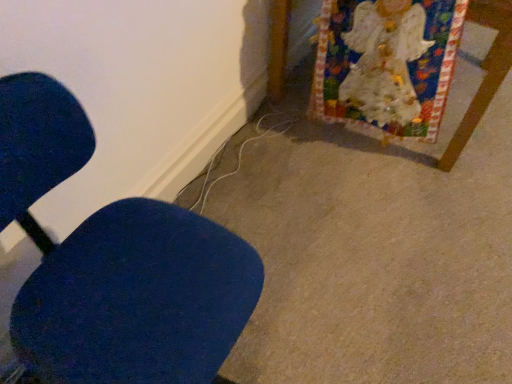
Describe the element at coordinates (114, 263) in the screenshot. I see `blue fabric chair at left` at that location.

I want to click on blue fabric chair at left, so click(x=114, y=263).

The width and height of the screenshot is (512, 384). Find the location of `white paper at upper right`. white paper at upper right is located at coordinates (484, 77).

The width and height of the screenshot is (512, 384). What do you see at coordinates (484, 77) in the screenshot?
I see `white paper at upper right` at bounding box center [484, 77].

I want to click on blue fabric chair at left, so click(x=114, y=263).

In the image, is blue fabric chair at left on the left side or the right side of white paper at upper right?

Result: From the image, it's evident that blue fabric chair at left is to the left of white paper at upper right.

Is blue fabric chair at left further to the viewer compared to white paper at upper right?

No, it is in front of white paper at upper right.

Based on the photo, which is nearer, (119, 238) or (284, 3)?

Positioned in front is point (119, 238).

From the image's perspective, is blue fabric chair at left located above or below white paper at upper right?

blue fabric chair at left is below white paper at upper right.

From a real-world perspective, which is physically above, blue fabric chair at left or white paper at upper right?

In real-world perspective, blue fabric chair at left is above.

Considering the relative sizes of blue fabric chair at left and white paper at upper right in the image provided, is blue fabric chair at left thinner than white paper at upper right?

Indeed, blue fabric chair at left has a lesser width compared to white paper at upper right.

Considering the sizes of objects blue fabric chair at left and white paper at upper right in the image provided, who is taller, blue fabric chair at left or white paper at upper right?

blue fabric chair at left is taller.

Is blue fabric chair at left smaller than white paper at upper right?

Yes.

Can we say blue fabric chair at left lies outside white paper at upper right?

Yes.

Are blue fabric chair at left and white paper at upper right beside each other?

blue fabric chair at left and white paper at upper right are not in contact.

Is blue fabric chair at left oriented away from white paper at upper right?

No.

How different are the orientations of blue fabric chair at left and white paper at upper right in degrees?

There is a 1.68-degree angle between the facing directions of blue fabric chair at left and white paper at upper right.

This screenshot has width=512, height=384. In the image, there is a white paper at upper right. What are the coordinates of `chair below it (from the image's perspective)` in the screenshot? It's located at (114, 263).

Would you say white paper at upper right is to the left or to the right of blue fabric chair at left in the picture?

In the image, white paper at upper right appears on the right side of blue fabric chair at left.

Is the position of white paper at upper right more distant than that of blue fabric chair at left?

Yes, the depth of white paper at upper right is greater than that of blue fabric chair at left.

Considering the points (486, 84) and (149, 296), which point is behind, point (486, 84) or point (149, 296)?

The point (486, 84) is farther from the camera.

From the image's perspective, is white paper at upper right positioned above or below blue fabric chair at left?

white paper at upper right is above blue fabric chair at left.

From a real-world perspective, is white paper at upper right over blue fabric chair at left?

No, from a real-world perspective, white paper at upper right is not over blue fabric chair at left

Does white paper at upper right have a greater width compared to blue fabric chair at left?

Yes, white paper at upper right is wider than blue fabric chair at left.

Which of these two, white paper at upper right or blue fabric chair at left, stands taller?

blue fabric chair at left.

Considering the sizes of objects white paper at upper right and blue fabric chair at left in the image provided, who is bigger, white paper at upper right or blue fabric chair at left?

white paper at upper right.

Would you say blue fabric chair at left is part of white paper at upper right's contents?

No, blue fabric chair at left is located outside of white paper at upper right.

Is white paper at upper right placed right next to blue fabric chair at left?

No, white paper at upper right is not making contact with blue fabric chair at left.

Is white paper at upper right positioned with its back to blue fabric chair at left?

That's not correct — white paper at upper right is not looking away from blue fabric chair at left.

How many degrees apart are the facing directions of white paper at upper right and blue fabric chair at left?

The facing directions of white paper at upper right and blue fabric chair at left are 1.68 degrees apart.

Measure the distance between white paper at upper right and blue fabric chair at left.

They are 1.25 meters apart.

Image resolution: width=512 pixels, height=384 pixels. Find the location of `chair located below the white paper at upper right (from the image's perspective)`. chair located below the white paper at upper right (from the image's perspective) is located at coordinates [x=114, y=263].

Where is `furniture that is on the right side of blue fabric chair at left`? The width and height of the screenshot is (512, 384). furniture that is on the right side of blue fabric chair at left is located at coordinates (484, 77).

In the image, there is a white paper at upper right. Where is `chair below it (from the image's perspective)`? This screenshot has width=512, height=384. chair below it (from the image's perspective) is located at coordinates (114, 263).